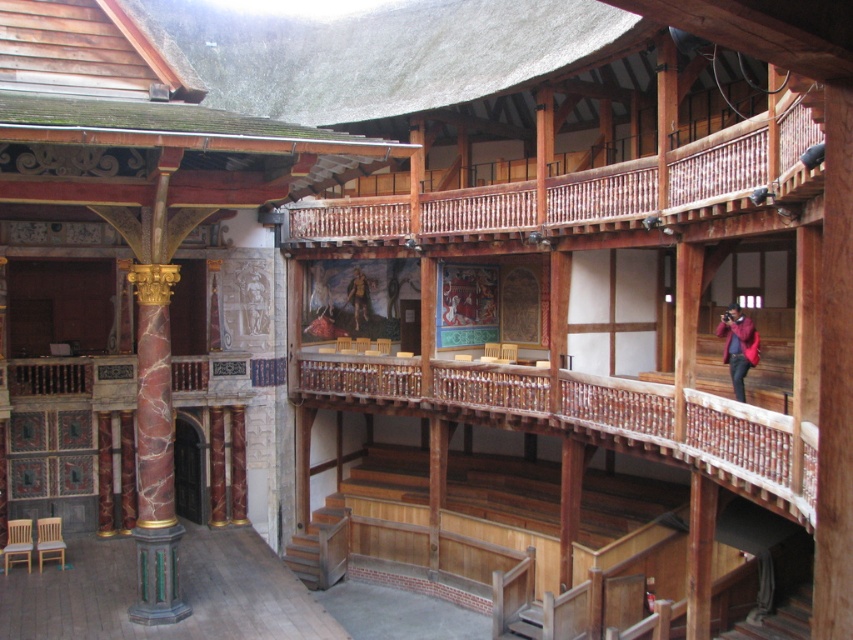
Question: Which object appears closest to the camera in this image?

Choices:
 (A) wooden railing at upper right
 (B) brown leather armor at center

Answer: (A)

Question: Does wooden stairs at lower center appear on the right side of brown leather armor at center?

Choices:
 (A) no
 (B) yes

Answer: (A)

Question: From the image, what is the correct spatial relationship of wooden railing at upper right in relation to wooden stairs at lower center?

Choices:
 (A) left
 (B) right

Answer: (B)

Question: Can you confirm if wooden stairs at lower center is bigger than red velvet coat at upper right?

Choices:
 (A) yes
 (B) no

Answer: (A)

Question: Among these objects, which one is farthest from the camera?

Choices:
 (A) brown leather armor at center
 (B) wooden railing at upper right

Answer: (A)

Question: Estimate the real-world distances between objects in this image. Which object is closer to the brown leather armor at center?

Choices:
 (A) wooden stairs at lower center
 (B) wooden railing at upper right
 (C) red velvet coat at upper right

Answer: (B)